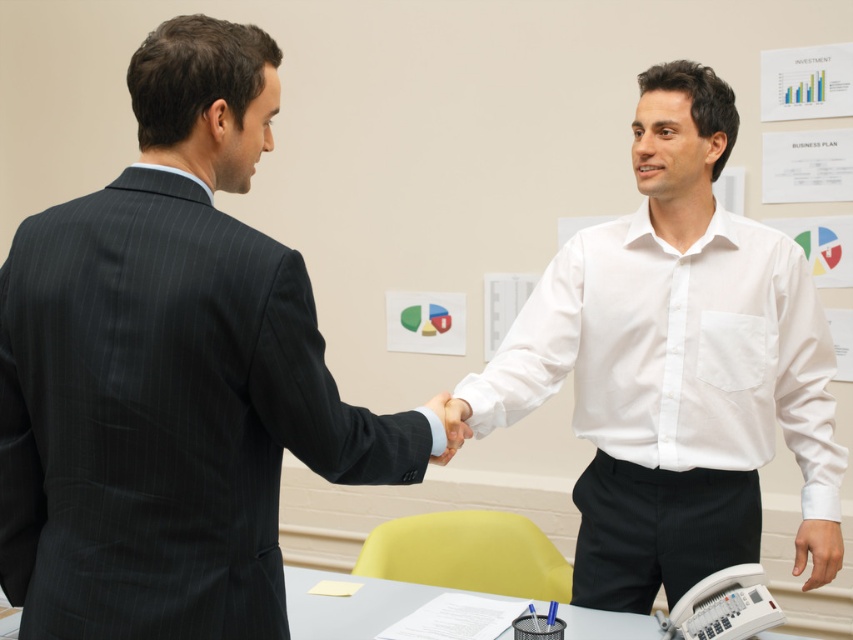
You are a photographer observing the scene. You need to capture a photo where the white cotton shirt at right and the white matte hand at center are both visible. Based on their positions, which object should appear higher in the final photo?

The white cotton shirt at right should appear higher in the final photo because it is positioned above the white matte hand at center according to the description.

You are an observer standing in front of the scene. You notice the dark pinstripe suit at center and the white matte hand at center. Which object is positioned closer to you?

The dark pinstripe suit at center is closer to the viewer than the white matte hand at center.

You are an event planner organizing a photoshoot for a business meeting. You need to position two models wearing the dark pinstripe suit at center and the white cotton shirt at right. According to the scene, which model should be placed closer to the camera to maintain the size relationship shown?

The dark pinstripe suit at center should be placed closer to the camera since it has a smaller size compared to the white cotton shirt at right, which means it appears closer to maintain the size difference.